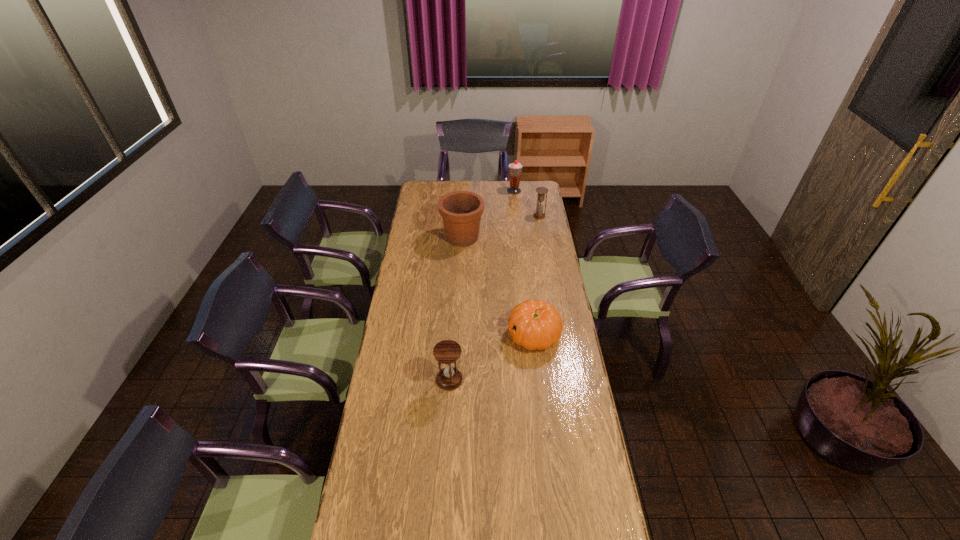
This screenshot has height=540, width=960. Find the location of `free point located on the back of the nearest object`. free point located on the back of the nearest object is located at coordinates 452,335.

The image size is (960, 540). Find the location of `vacant space situated 0.160m on the carved face of the fourth farthest object`. vacant space situated 0.160m on the carved face of the fourth farthest object is located at coordinates (471, 335).

This screenshot has height=540, width=960. Identify the location of free spot located 0.380m on the carved face of the fourth farthest object. (422, 335).

Identify the location of vacant space positioned on the carved face of the fourth farthest object. The width and height of the screenshot is (960, 540). (444, 335).

Locate an element on the screen. Image resolution: width=960 pixels, height=540 pixels. object present at the far edge is located at coordinates point(515,168).

Where is `smoothie present at the right edge`? This screenshot has width=960, height=540. smoothie present at the right edge is located at coordinates (515, 168).

Where is `hourglass located in the right edge section of the desktop`? hourglass located in the right edge section of the desktop is located at coordinates (541, 191).

I want to click on pumpkin that is at the right edge, so click(x=534, y=324).

Where is `object that is at the far right corner`? object that is at the far right corner is located at coordinates (515, 168).

Where is `free space at the far edge of the desktop`? free space at the far edge of the desktop is located at coordinates (486, 180).